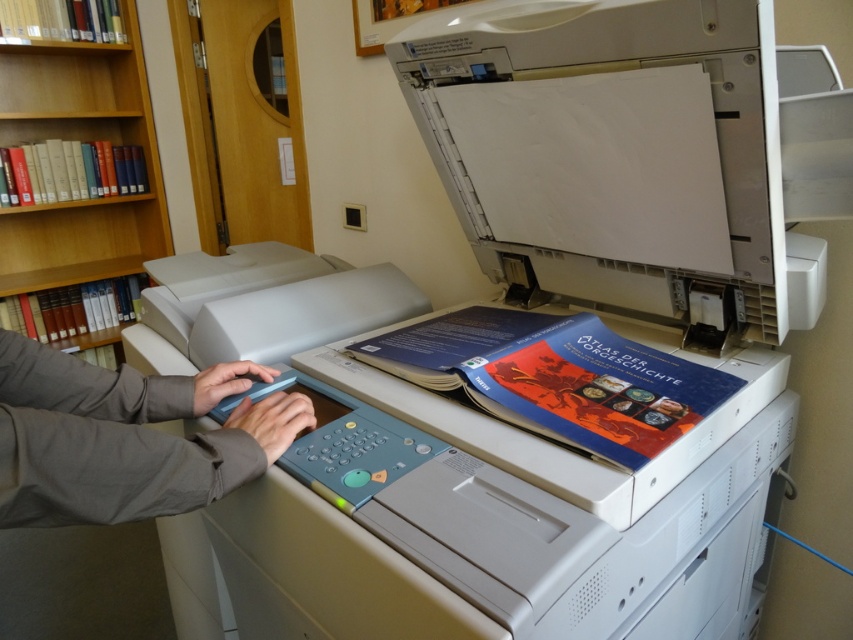
Who is shorter, gray fabric hands at center or white plastic printer at center?

gray fabric hands at center

Is gray fabric hands at center smaller than white plastic printer at center?

Yes.

At what (x,y) coordinates should I click in order to perform the action: click on gray fabric hands at center. Please return your answer as a coordinate pair (x, y). This screenshot has height=640, width=853. Looking at the image, I should click on (126, 436).

Which is below, wooden bookshelf at left or white plastic printer at center?

white plastic printer at center is below.

Can you confirm if wooden bookshelf at left is positioned to the left of white plastic printer at center?

Indeed, wooden bookshelf at left is positioned on the left side of white plastic printer at center.

Between point (134, 264) and point (292, 292), which one is positioned in front?

Point (292, 292)

Where is `wooden bookshelf at left`? wooden bookshelf at left is located at coordinates (79, 140).

Is point (65, 408) farther from viewer compared to point (91, 129)?

That is False.

Between point (160, 488) and point (42, 120), which one is positioned behind?

Positioned behind is point (42, 120).

Where is `gray fabric hands at center`? gray fabric hands at center is located at coordinates (126, 436).